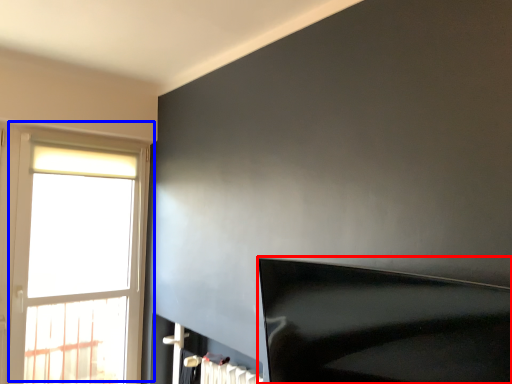
Question: Among these objects, which one is farthest to the camera, furniture (highlighted by a red box) or window (highlighted by a blue box)?

Choices:
 (A) furniture
 (B) window

Answer: (B)